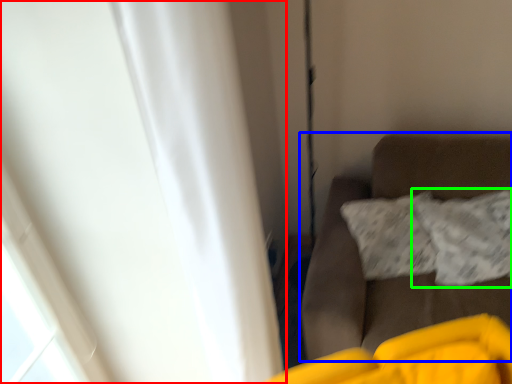
Question: Which is farther away from curtain (highlighted by a red box)? furniture (highlighted by a blue box) or pillow (highlighted by a green box)?

Choices:
 (A) furniture
 (B) pillow

Answer: (B)